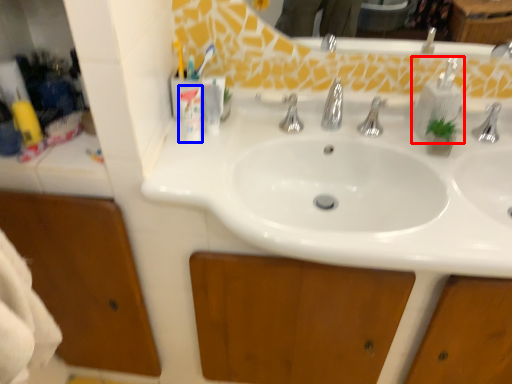
Question: Among these objects, which one is nearest to the camera, soap dispenser (highlighted by a red box) or toiletry (highlighted by a blue box)?

Choices:
 (A) soap dispenser
 (B) toiletry

Answer: (B)